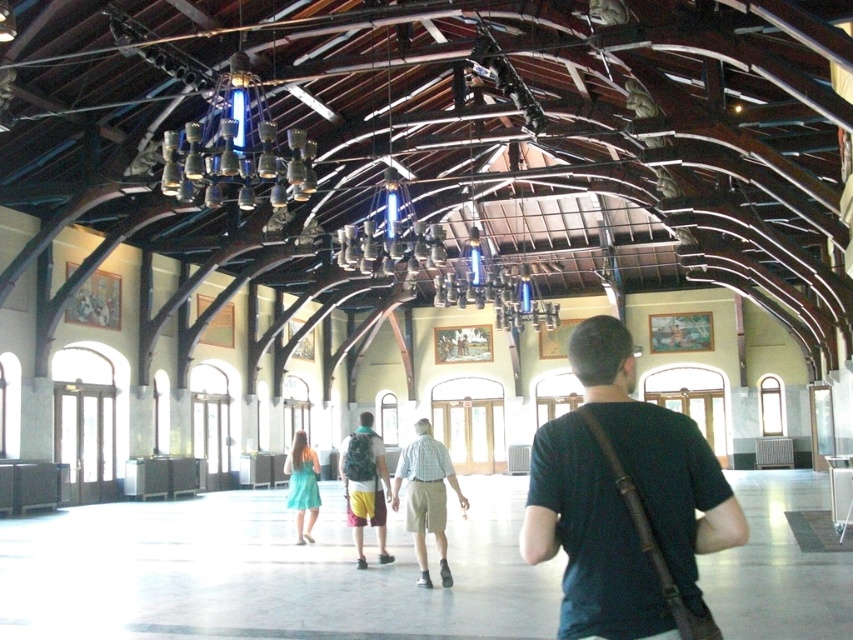
Between black leather bag at center and light blue plaid shirt at center, which one has less height?

Standing shorter between the two is light blue plaid shirt at center.

Does black leather bag at center lie behind light blue plaid shirt at center?

No, it is in front of light blue plaid shirt at center.

Which is in front, point (665, 408) or point (442, 460)?

Point (442, 460) is in front.

This screenshot has width=853, height=640. What are the coordinates of `black leather bag at center` in the screenshot? It's located at (625, 502).

Who is more forward, (701,476) or (357,496)?

Positioned in front is point (701,476).

Between black leather bag at center and camouflage backpack at center, which one appears on the left side from the viewer's perspective?

Positioned to the left is camouflage backpack at center.

Is point (589, 436) farther from camera compared to point (364, 456)?

No, (589, 436) is in front of (364, 456).

Identify the location of black leather bag at center. (625, 502).

Who is lower down, camouflage backpack at center or teal fabric dress at center?

Positioned lower is teal fabric dress at center.

Does camouflage backpack at center have a lesser height compared to teal fabric dress at center?

Incorrect, camouflage backpack at center's height does not fall short of teal fabric dress at center's.

Is point (347, 454) less distant than point (297, 499)?

That is True.

You are a GUI agent. You are given a task and a screenshot of the screen. Output one action in this format:
    pyautogui.click(x=<x>, y=<y>)
    Task: Click on the camouflage backpack at center
    The height and width of the screenshot is (640, 853).
    Given the screenshot: What is the action you would take?
    pyautogui.click(x=364, y=484)